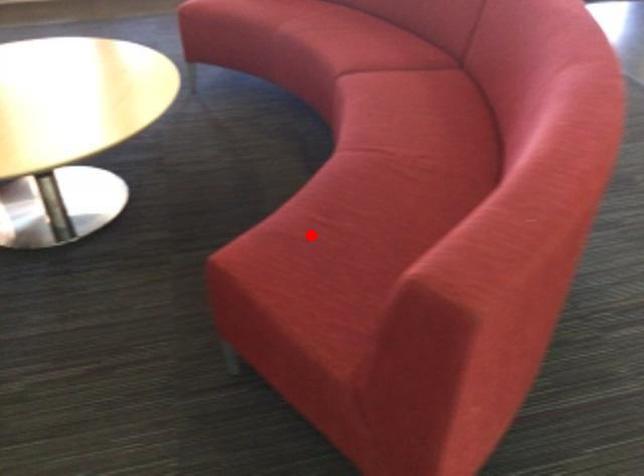
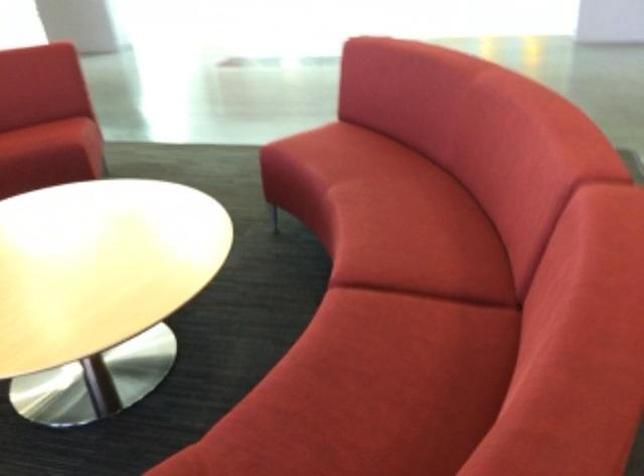
Question: I am providing you with two images of the same scene from different viewpoints. A red point is shown in image1. For the corresponding object point in image2, is it positioned nearer or farther from the camera?

Choices:
 (A) Nearer
 (B) Farther

Answer: (B)